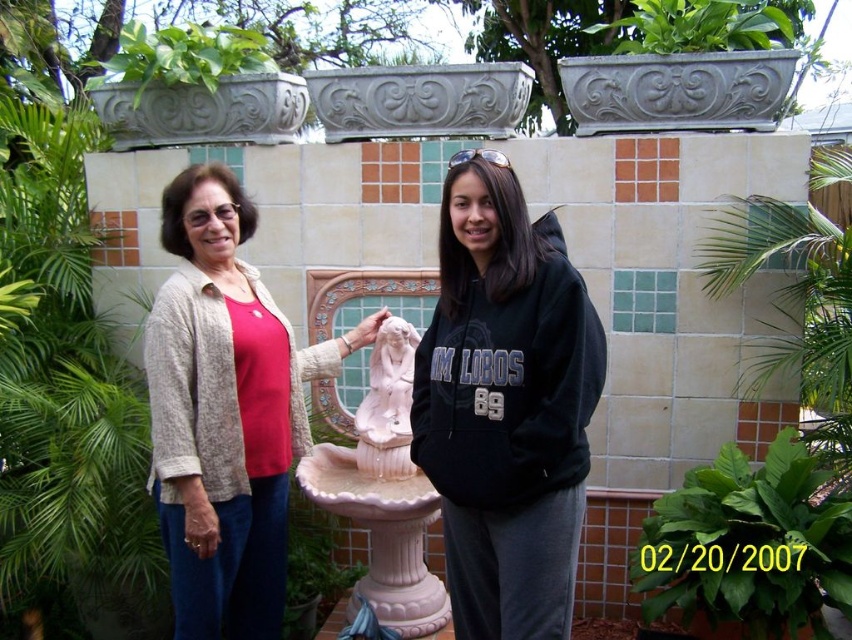
Based on the photo, you are a photographer trying to capture a clear shot of the black fleece sweatshirt at center and the green leafy plant at upper center. Which object should you focus on first to ensure both are in focus?

You should focus on the black fleece sweatshirt at center first because it is closer to the camera than the green leafy plant at upper center. By focusing on the closer object, the background object will also be in focus due to the depth of field.

Consider the image. You are trying to decide which item to pack for a trip. You have a small backpack and need to know which item is narrower between the black fleece sweatshirt at center and the green leafy plant at upper left. Which one should you choose?

The black fleece sweatshirt at center is narrower than the green leafy plant at upper left, so you should choose the black fleece sweatshirt at center to fit better in your small backpack.